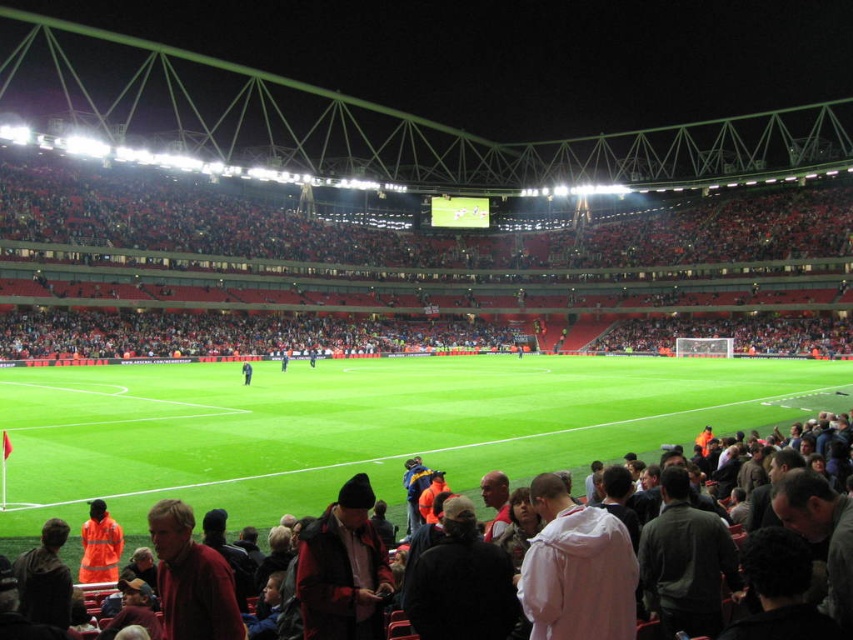
You are a spectator trying to locate your friend wearing a dark blue jacket at center from your seat at the red plastic seats at upper center. Can you see their jacket clearly?

The red plastic seats at upper center is much taller as dark blue jacket at center, so yes, you can see the dark blue jacket at center clearly from your seat.

What is the spatial relationship between the red plastic seats at upper center and the orange raincoat at lower left in the soccer stadium scene?

The red plastic seats at upper center are located to the right of the orange raincoat at lower left.

You are a photographer standing at the edge of the soccer field. You want to take a photo that includes both the dark gray jacket at lower center and the dark blue jacket at center. Which jacket will appear larger in the photo?

The dark gray jacket at lower center will appear larger in the photo because it is much taller than the dark blue jacket at center.